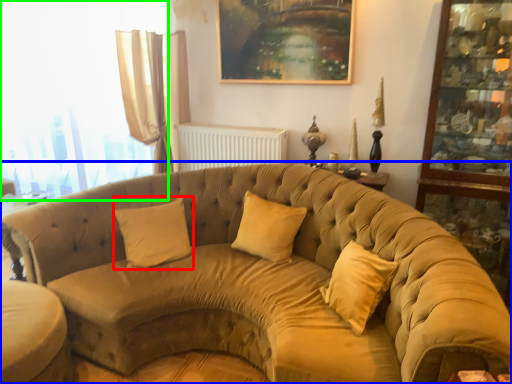
Question: Based on their relative distances, which object is farther from pillow (highlighted by a red box)? Choose from studio couch (highlighted by a blue box) and window (highlighted by a green box).

Choices:
 (A) studio couch
 (B) window

Answer: (B)